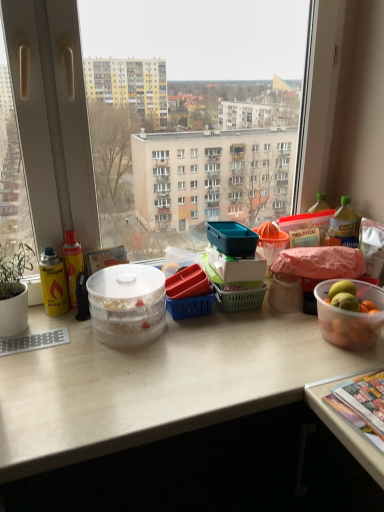
Image resolution: width=384 pixels, height=512 pixels. In order to click on blank space situated above transparent plastic bowl at center, marked as the first bowl in a left-to-right arrangement (from a real-world perspective) in this screenshot , I will do `click(127, 275)`.